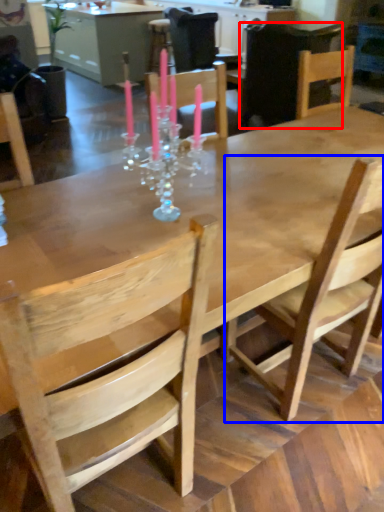
Question: Which object appears farthest to the camera in this image, chair (highlighted by a red box) or chair (highlighted by a blue box)?

Choices:
 (A) chair
 (B) chair

Answer: (A)